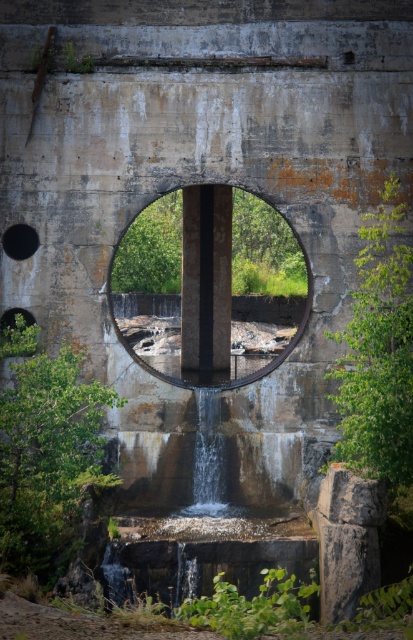
Consider the image. Can you confirm if green leafy tree at lower left is positioned to the left of green leafy plant at right?

Indeed, green leafy tree at lower left is positioned on the left side of green leafy plant at right.

Is green leafy tree at lower left further to camera compared to green leafy plant at right?

No, it is not.

Between point (109, 474) and point (370, 468), which one is positioned behind?

The point (109, 474) is more distant.

Image resolution: width=413 pixels, height=640 pixels. I want to click on green leafy tree at lower left, so click(45, 452).

Which is below, concrete/rough hole at center or clear water at center?

clear water at center

Can you confirm if concrete/rough hole at center is wider than clear water at center?

Yes.

Between point (206, 227) and point (199, 465), which one is positioned in front?

Point (199, 465)

The image size is (413, 640). In order to click on concrete/rough hole at center in this screenshot , I will do `click(203, 307)`.

What are the coordinates of `black matte hole at upper left` in the screenshot? It's located at (19, 241).

Is black matte hole at upper left thinner than green leafy bush at lower left?

No, black matte hole at upper left is not thinner than green leafy bush at lower left.

Between point (23, 241) and point (14, 308), which one is positioned behind?

The point (23, 241) is more distant.

In order to click on black matte hole at upper left in this screenshot , I will do `click(19, 241)`.